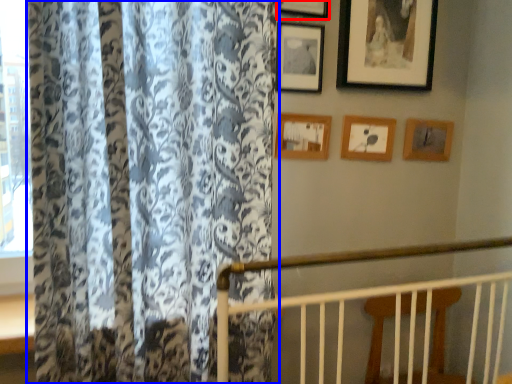
Question: Which of the following is the closest to the observer, picture frame (highlighted by a red box) or curtain (highlighted by a blue box)?

Choices:
 (A) picture frame
 (B) curtain

Answer: (B)